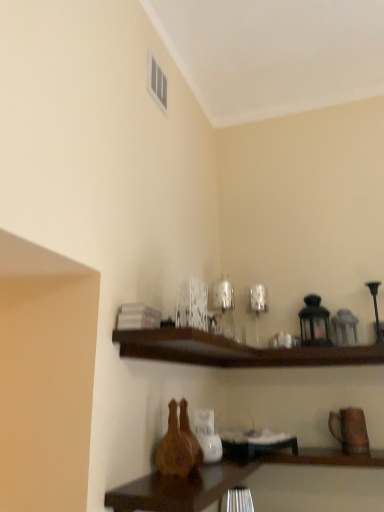
What is the approximate width of wooden table at lower center?

It is 33.20 inches.

This screenshot has height=512, width=384. In order to click on brown matte vase at lower right in this screenshot , I will do `click(350, 430)`.

This screenshot has height=512, width=384. In order to click on wooden table at lower center in this screenshot , I will do `click(179, 489)`.

I want to click on table located below the brown matte vase at lower right (from the image's perspective), so click(x=179, y=489).

Is wooden table at lower center turned away from brown matte vase at lower right?

No, wooden table at lower center is not facing away from brown matte vase at lower right.

From the image's perspective, is wooden table at lower center above brown matte vase at lower right?

Incorrect, from the image's perspective, wooden table at lower center is lower than brown matte vase at lower right.

Is wooden table at lower center to the left of brown matte vase at lower right from the viewer's perspective?

Yes.

From the image's perspective, is brown matte vase at lower right above or below matte white vent at upper center?

Based on their image positions, brown matte vase at lower right is located beneath matte white vent at upper center.

Is point (345, 419) closer or farther from the camera than point (150, 82)?

Point (345, 419) is farther from the camera than point (150, 82).

Is matte white vent at upper center a part of brown matte vase at lower right?

No, matte white vent at upper center is not surrounded by brown matte vase at lower right.

How far apart are brown matte vase at lower right and matte white vent at upper center?

brown matte vase at lower right and matte white vent at upper center are 1.29 meters apart.

This screenshot has height=512, width=384. Identify the location of shelf above the wooden table at lower center (from a real-world perspective). (187, 347).

Does wooden table at lower center appear on the left side of dark wood shelf at upper center?

Yes.

Is wooden table at lower center turned away from dark wood shelf at upper center?

No, wooden table at lower center is not facing the opposite direction of dark wood shelf at upper center.

Is brown matte vase at lower right far from wooden table at lower center?

No, there isn't a large distance between brown matte vase at lower right and wooden table at lower center.

Who is shorter, brown matte vase at lower right or wooden table at lower center?

wooden table at lower center is shorter.

Which object is further away from the camera, brown matte vase at lower right or wooden table at lower center?

brown matte vase at lower right is further from the camera.

Considering the sizes of brown matte vase at lower right and wooden table at lower center in the image, is brown matte vase at lower right wider or thinner than wooden table at lower center?

In the image, brown matte vase at lower right appears to be more narrow than wooden table at lower center.

Where is `pottery below the dark wood shelf at upper center (from a real-world perspective)`? pottery below the dark wood shelf at upper center (from a real-world perspective) is located at coordinates (350, 430).

Is dark wood shelf at upper center with brown matte vase at lower right?

dark wood shelf at upper center and brown matte vase at lower right are clearly separated.

Considering the relative sizes of dark wood shelf at upper center and brown matte vase at lower right in the image provided, is dark wood shelf at upper center taller than brown matte vase at lower right?

Incorrect, the height of dark wood shelf at upper center is not larger of that of brown matte vase at lower right.

Considering the positions of objects dark wood shelf at upper center and brown matte vase at lower right in the image provided, who is more to the left, dark wood shelf at upper center or brown matte vase at lower right?

dark wood shelf at upper center.

Looking at this image, is wooden table at lower center surrounded by matte white vent at upper center?

No, wooden table at lower center is located outside of matte white vent at upper center.

In the scene shown: Between matte white vent at upper center and wooden table at lower center, which one appears on the right side from the viewer's perspective?

Answer: Positioned to the right is wooden table at lower center.

Does matte white vent at upper center have a lesser height compared to wooden table at lower center?

No.

Is wooden table at lower center at the back of matte white vent at upper center?

No, matte white vent at upper center's orientation is not away from wooden table at lower center.

Who is more distant, dark wood shelf at upper center or wooden table at lower center?

Positioned behind is dark wood shelf at upper center.

The height and width of the screenshot is (512, 384). Identify the location of shelf on the right of wooden table at lower center. (187, 347).

Does dark wood shelf at upper center have a larger size compared to wooden table at lower center?

No, dark wood shelf at upper center is not bigger than wooden table at lower center.

Where is `pottery to the right of wooden table at lower center`? pottery to the right of wooden table at lower center is located at coordinates (350, 430).

Locate an element on the screen. window on the left of the brown matte vase at lower right is located at coordinates (157, 82).

When comparing their distances from matte white vent at upper center, does dark wood shelf at upper center or wooden table at lower center seem further?

The object further to matte white vent at upper center is wooden table at lower center.

Estimate the real-world distances between objects in this image. Which object is closer to dark wood shelf at upper center, brown matte vase at lower right or matte white vent at upper center?

brown matte vase at lower right.

Looking at the image, which one is located closer to matte white vent at upper center, brown matte vase at lower right or wooden table at lower center?

wooden table at lower center.

From the image, which object appears to be farther from matte white vent at upper center, wooden table at lower center or brown matte vase at lower right?

Among the two, brown matte vase at lower right is located further to matte white vent at upper center.

Estimate the real-world distances between objects in this image. Which object is closer to brown matte vase at lower right, matte white vent at upper center or wooden table at lower center?

Based on the image, wooden table at lower center appears to be nearer to brown matte vase at lower right.

Which object lies further to the anchor point wooden table at lower center, brown matte vase at lower right or matte white vent at upper center?

matte white vent at upper center lies further to wooden table at lower center than the other object.

From the image, which object appears to be farther from wooden table at lower center, brown matte vase at lower right or dark wood shelf at upper center?

brown matte vase at lower right is further to wooden table at lower center.

Based on their spatial positions, is dark wood shelf at upper center or matte white vent at upper center closer to wooden table at lower center?

The object closer to wooden table at lower center is dark wood shelf at upper center.

Where is `shelf between matte white vent at upper center and brown matte vase at lower right vertically`? The width and height of the screenshot is (384, 512). shelf between matte white vent at upper center and brown matte vase at lower right vertically is located at coordinates (187, 347).

At what (x,y) coordinates should I click in order to perform the action: click on shelf between wooden table at lower center and brown matte vase at lower right from front to back. Please return your answer as a coordinate pair (x, y). Image resolution: width=384 pixels, height=512 pixels. Looking at the image, I should click on (187, 347).

Identify the location of shelf that lies between matte white vent at upper center and wooden table at lower center from top to bottom. (187, 347).

Locate an element on the screen. pottery that lies between matte white vent at upper center and wooden table at lower center from top to bottom is located at coordinates (350, 430).